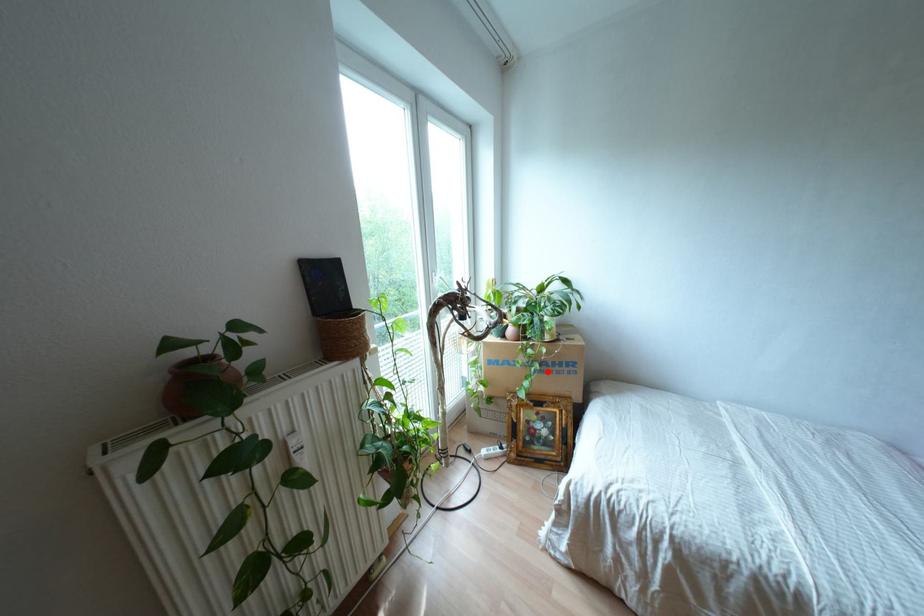
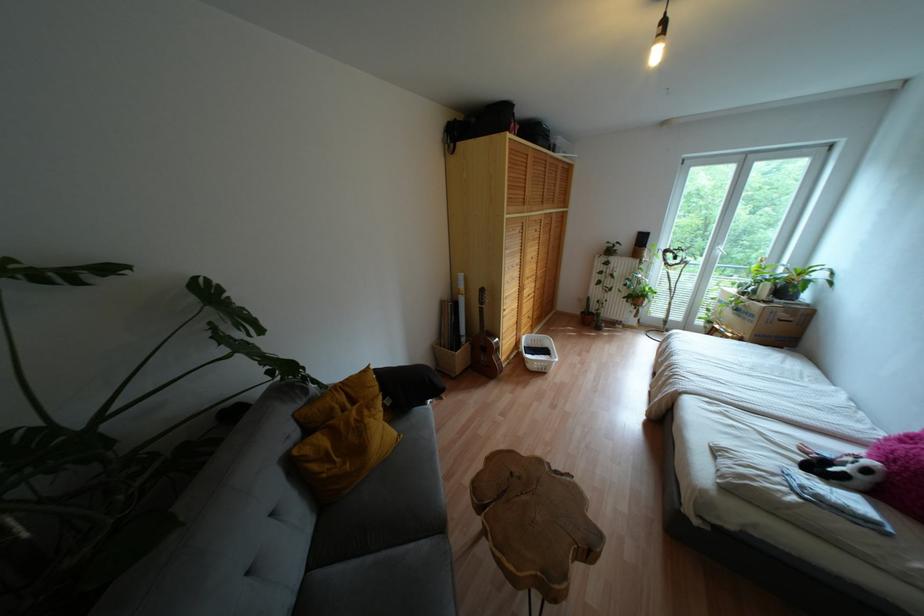
Question: I am providing you with two images of the same scene from different viewpoints. A red point is shown in image1. For the corresponding object point in image2, is it positioned nearer or farther from the camera?

Choices:
 (A) Nearer
 (B) Farther

Answer: (A)